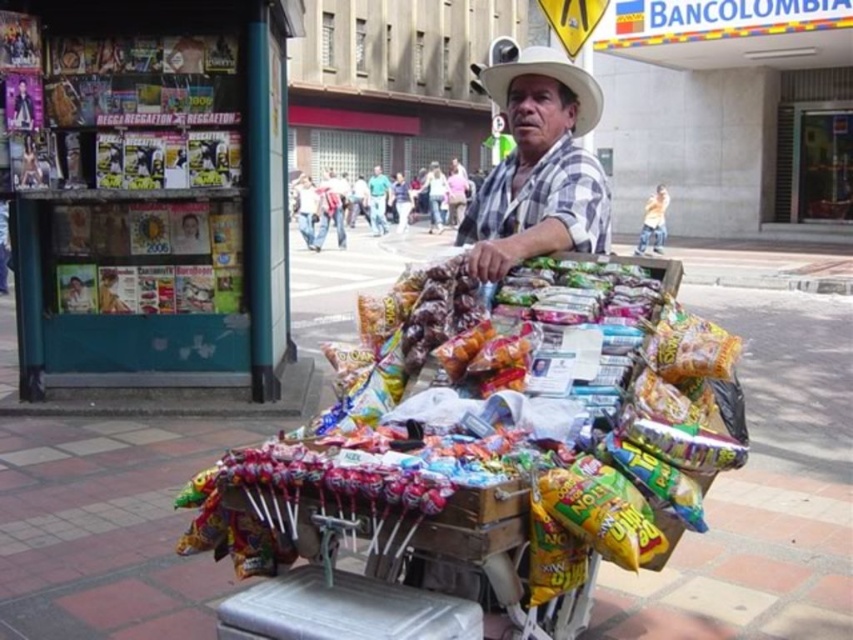
Question: Which point is closer to the camera?

Choices:
 (A) green fabric shirt at center
 (B) white felt cowboy hat at center

Answer: (B)

Question: In this image, where is white checkered shirt at center located relative to green fabric shirt at center?

Choices:
 (A) right
 (B) left

Answer: (A)

Question: Which object is positioned closest to the green fabric shirt at center?

Choices:
 (A) multicolored plastic candy at center
 (B) white felt cowboy hat at center
 (C) white checkered shirt at center

Answer: (B)

Question: Does multicolored plastic candy at center have a greater width compared to green fabric shirt at center?

Choices:
 (A) yes
 (B) no

Answer: (A)

Question: Among these points, which one is farthest from the camera?

Choices:
 (A) (561, 68)
 (B) (428, 324)
 (C) (548, 67)
 (D) (383, 180)

Answer: (D)

Question: Does white checkered shirt at center appear under green fabric shirt at center?

Choices:
 (A) no
 (B) yes

Answer: (B)